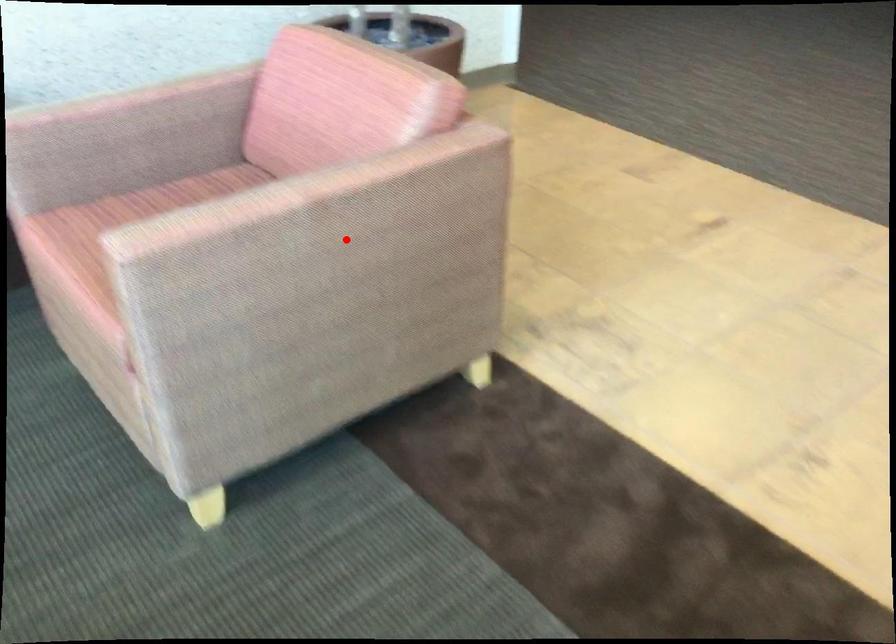
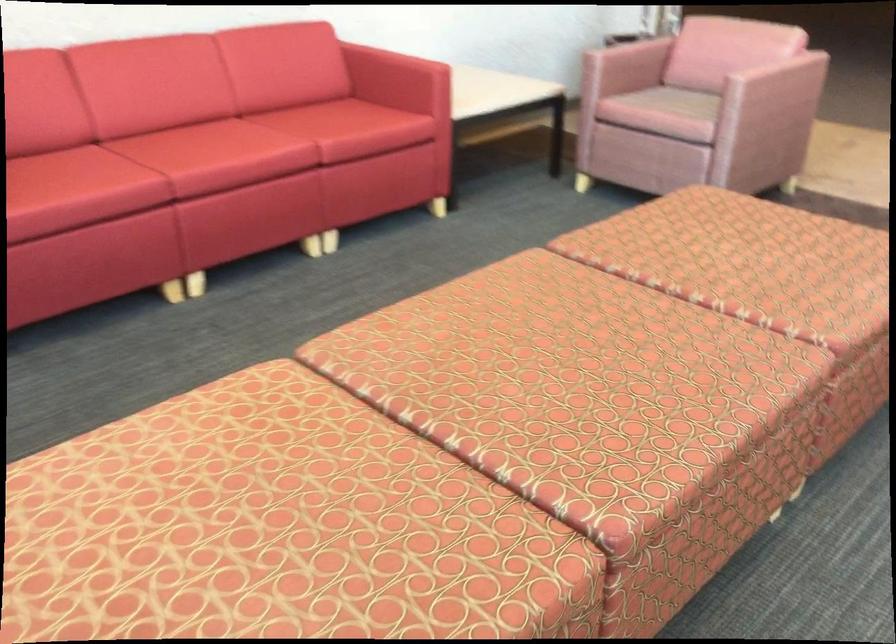
Find the pixel in the second image that matches the highlighted location in the first image.

(773, 90)